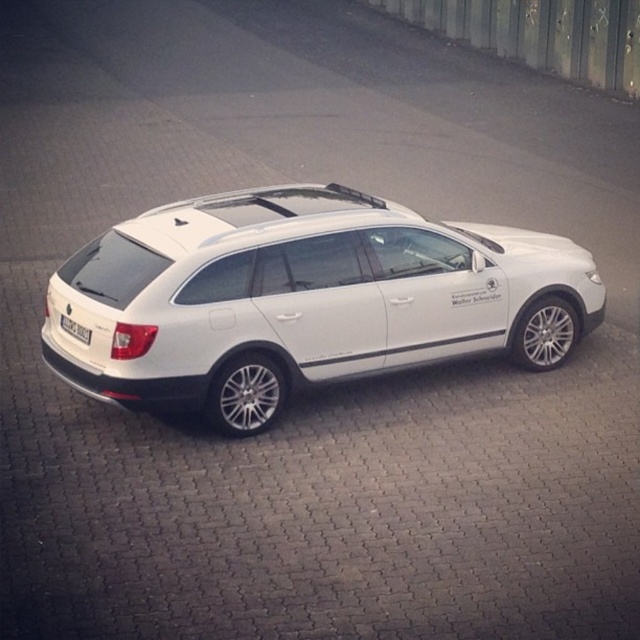
You are a delivery person trying to read the license plate of the white metallic car at center. Can you see the white plastic license plate at lower left clearly from your current position?

The white metallic car at center is positioned over white plastic license plate at lower left, so the license plate is obscured by the car and cannot be read clearly.

You are standing next to a camera that is 6.82 meters away from the white metallic car at center. If you want to take a photo of the car using this camera, would you need to adjust the zoom to capture the entire car in the frame?

The white metallic car at center and camera are 6.82 meters apart from each other. To determine if the zoom needs adjustment, one would need to know the camera sensor size, lens focal length, and desired framing. However, based on typical mid to wide angle settings for such distances, it might be possible without zooming in excessively, but specifics depend on equipment.

You are standing in front of a white Skoda Superb estate car parked on a paved area with a brick pattern. You notice a point marked at coordinates (304, 298). Which object does this point correspond to?

The point at coordinates (304, 298) corresponds to the white metallic car at center.